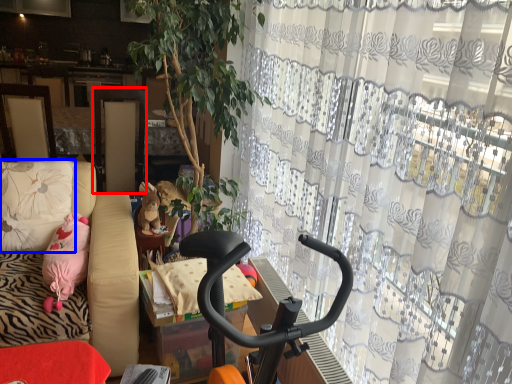
Question: Which object appears farthest to the camera in this image, screen door (highlighted by a red box) or pillow (highlighted by a blue box)?

Choices:
 (A) screen door
 (B) pillow

Answer: (A)